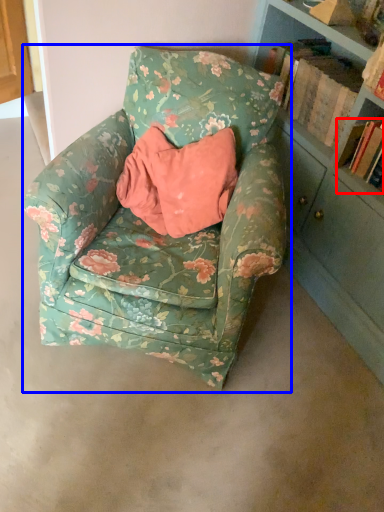
Question: Which point is closer to the camera, book (highlighted by a red box) or chair (highlighted by a blue box)?

Choices:
 (A) book
 (B) chair

Answer: (B)